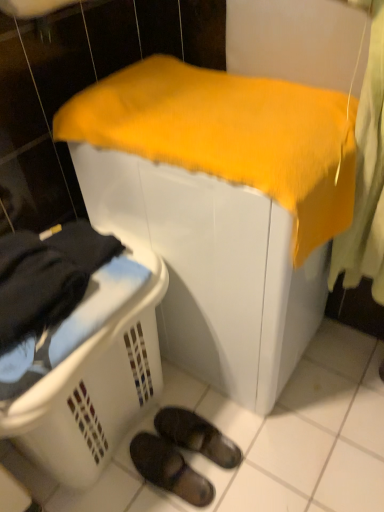
Question: Is white plastic laundry basket at lower left far from yellow fabric-covered object at center?

Choices:
 (A) no
 (B) yes

Answer: (A)

Question: Does white plastic laundry basket at lower left appear on the right side of yellow fabric-covered object at center?

Choices:
 (A) no
 (B) yes

Answer: (A)

Question: Does white plastic laundry basket at lower left appear on the left side of yellow fabric-covered object at center?

Choices:
 (A) yes
 (B) no

Answer: (A)

Question: Is white plastic laundry basket at lower left aimed at yellow fabric-covered object at center?

Choices:
 (A) yes
 (B) no

Answer: (B)

Question: Does white plastic laundry basket at lower left lie in front of yellow fabric-covered object at center?

Choices:
 (A) no
 (B) yes

Answer: (B)

Question: In terms of size, does white plastic laundry basket at lower left appear bigger or smaller than black rubber slippers at lower center, the first footwear when ordered from bottom to top?

Choices:
 (A) small
 (B) big

Answer: (B)

Question: Choose the correct answer: Is white plastic laundry basket at lower left inside black rubber slippers at lower center, the first footwear when ordered from bottom to top, or outside it?

Choices:
 (A) outside
 (B) inside

Answer: (A)

Question: Considering the positions of point (69, 411) and point (160, 438), is point (69, 411) closer or farther from the camera than point (160, 438)?

Choices:
 (A) farther
 (B) closer

Answer: (B)

Question: Is white plastic laundry basket at lower left in front of or behind black rubber slippers at lower center, the second footwear from the top, in the image?

Choices:
 (A) behind
 (B) front

Answer: (B)

Question: From a real-world perspective, relative to yellow fabric-covered object at center, is black rubber slippers at lower center, the second footwear from the top, vertically above or below?

Choices:
 (A) above
 (B) below

Answer: (B)

Question: Considering their positions, is black rubber slippers at lower center, the first footwear when ordered from bottom to top, located in front of or behind yellow fabric-covered object at center?

Choices:
 (A) behind
 (B) front

Answer: (A)

Question: Is black rubber slippers at lower center, the first footwear when ordered from bottom to top, to the left or to the right of yellow fabric-covered object at center in the image?

Choices:
 (A) left
 (B) right

Answer: (A)

Question: From their relative heights in the image, would you say black rubber slippers at lower center, the second footwear from the top, is taller or shorter than yellow fabric-covered object at center?

Choices:
 (A) tall
 (B) short

Answer: (B)

Question: From the image's perspective, is black rubber slippers at lower center, the second footwear from the top, positioned above or below white plastic laundry basket at lower left?

Choices:
 (A) above
 (B) below

Answer: (B)

Question: Choose the correct answer: Is black rubber slippers at lower center, the second footwear from the top, inside white plastic laundry basket at lower left or outside it?

Choices:
 (A) outside
 (B) inside

Answer: (A)